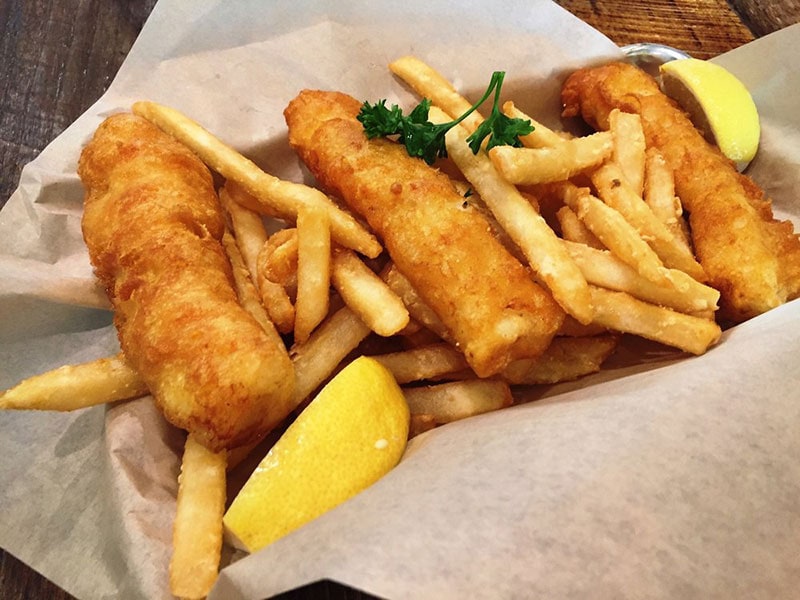
You are a GUI agent. You are given a task and a screenshot of the screen. Output one action in this format:
    pyautogui.click(x=<x>, y=<y>)
    Task: Click on the sheet
    Image resolution: width=800 pixels, height=600 pixels.
    Given the screenshot: What is the action you would take?
    pyautogui.click(x=632, y=520)